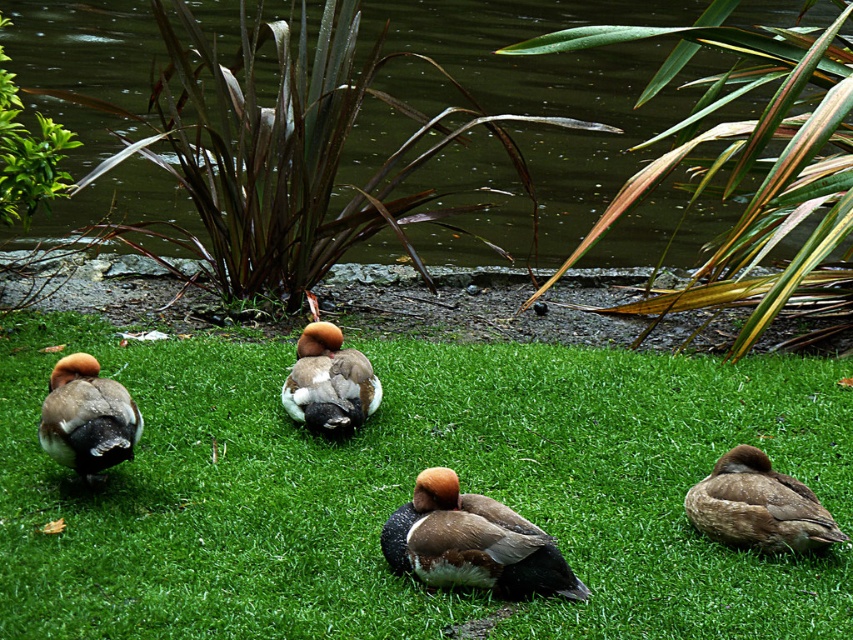
You are a drone operator trying to capture aerial footage of the ducks in the scene. You have two points marked on your screen for camera positioning. The first point is at coordinates point (374, 124), and the second is at point (711, 522). Which point should you choose to ensure the camera is positioned behind the ducks to film them from a rear angle?

Point (374, 124) is behind point (711, 522), so choosing point (374, 124) will position the camera behind the ducks to film them from a rear angle.

In the scene shown: You are a drone operator trying to capture a photo of the green grassy area at center. The drone is currently hovering at point (410, 490). Is the drone positioned directly above the green grassy area at center?

Yes, the point (410, 490) marks the green grassy area at center, so the drone is positioned directly above it.

You are a drone operator trying to capture a photo of the ducks on the green grassy at center. The drone must stay within a 100m radius from the center point. If the center of the image is at coordinate origin, can the drone capture the ducks within the radius?

The green grassy at center is located at point (410, 490). Since the center of the image is the origin, the distance from the origin to this point is sqrt0.767 squared plus 0.482 squared equals approximately sqrt0.588 plus 0.232 equals sqrt0.82 equals 0.906 units. If the radius is 1 unit, then 0.906 is within the 100m radius. So yes, the drone can capture the ducks within the radius.